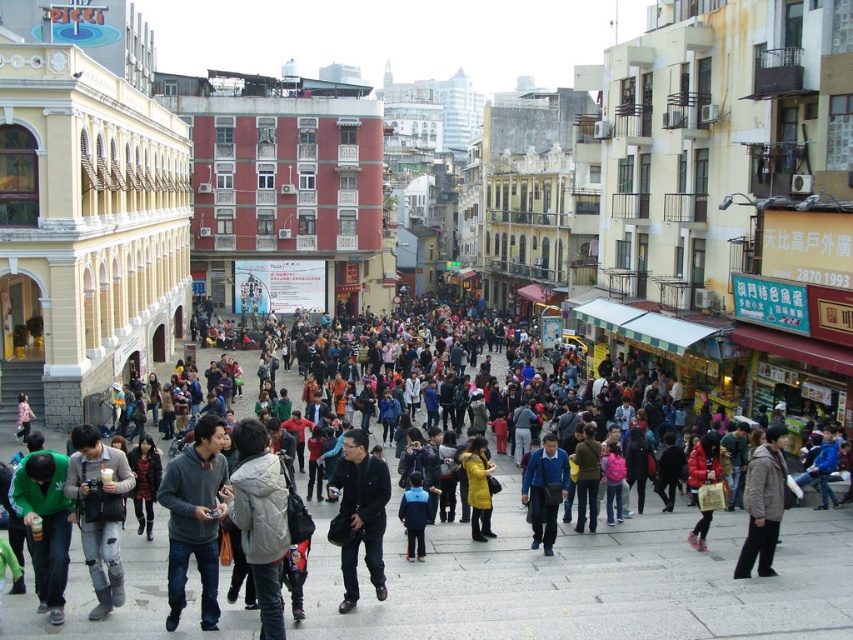
You are standing at the edge of a busy street market and see the matte gray building at center and the blue fabric jacket at center. If you want to reach both, which one would you need to walk further to get to?

The matte gray building at center is 206.54 feet away from the blue fabric jacket at center. Since you are at the edge of the street market, you would need to walk further to reach the matte gray building at center because it is farther away than the blue fabric jacket at center.

You are a photographer standing in the middle of the street and see the ripped jeans at lower left and the blue matte jacket at center. Which clothing item is closer to the left side of the image?

The ripped jeans at lower left is positioned on the left side of blue matte jacket at center, so the ripped jeans at lower left is closer to the left side of the image.